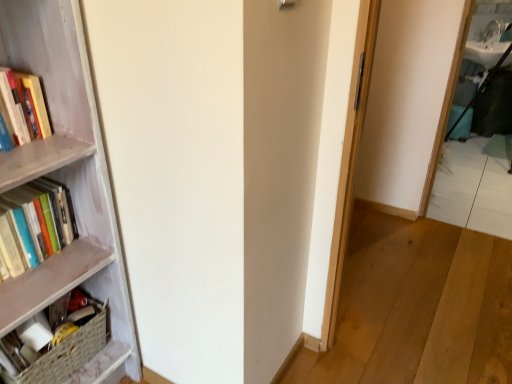
Question: Is woven basket at lower left, acting as the 2th book starting from the top, with wooden bookcase at left?

Choices:
 (A) no
 (B) yes

Answer: (A)

Question: Does woven basket at lower left, acting as the 2th book starting from the top, have a lesser width compared to wooden bookcase at left?

Choices:
 (A) yes
 (B) no

Answer: (A)

Question: Is woven basket at lower left, acting as the 2th book starting from the top, smaller than wooden bookcase at left?

Choices:
 (A) yes
 (B) no

Answer: (A)

Question: Is woven basket at lower left, acting as the 2th book starting from the top, further to the viewer compared to wooden bookcase at left?

Choices:
 (A) yes
 (B) no

Answer: (A)

Question: Does woven basket at lower left, acting as the 2th book starting from the top, appear on the left side of wooden bookcase at left?

Choices:
 (A) no
 (B) yes

Answer: (B)

Question: In the image, is hardcover books at left, the 2th book from the bottom, positioned in front of or behind wooden bookcase at left?

Choices:
 (A) front
 (B) behind

Answer: (B)

Question: In terms of height, does hardcover books at left, the 2th book from the bottom, look taller or shorter compared to wooden bookcase at left?

Choices:
 (A) short
 (B) tall

Answer: (A)

Question: From the image's perspective, is hardcover books at left, marked as the 1th book in a top-to-bottom arrangement, positioned above or below wooden bookcase at left?

Choices:
 (A) below
 (B) above

Answer: (B)

Question: Choose the correct answer: Is hardcover books at left, marked as the 1th book in a top-to-bottom arrangement, inside wooden bookcase at left or outside it?

Choices:
 (A) inside
 (B) outside

Answer: (A)

Question: In the image, is woven basket at lower left, acting as the 2th book starting from the top, positioned in front of or behind wooden bookcase at left?

Choices:
 (A) behind
 (B) front

Answer: (A)

Question: Considering the positions of woven basket at lower left, arranged as the first book when ordered from the bottom, and wooden bookcase at left in the image, is woven basket at lower left, arranged as the first book when ordered from the bottom, wider or thinner than wooden bookcase at left?

Choices:
 (A) thin
 (B) wide

Answer: (A)

Question: Choose the correct answer: Is woven basket at lower left, arranged as the first book when ordered from the bottom, inside wooden bookcase at left or outside it?

Choices:
 (A) outside
 (B) inside

Answer: (B)

Question: From a real-world perspective, is woven basket at lower left, arranged as the first book when ordered from the bottom, physically located above or below wooden bookcase at left?

Choices:
 (A) below
 (B) above

Answer: (A)

Question: Based on their sizes in the image, would you say woven basket at lower left, acting as the 2th book starting from the top, is bigger or smaller than hardcover books at left, the 2th book from the bottom?

Choices:
 (A) big
 (B) small

Answer: (A)

Question: Visually, is woven basket at lower left, acting as the 2th book starting from the top, positioned to the left or to the right of hardcover books at left, marked as the 1th book in a top-to-bottom arrangement?

Choices:
 (A) right
 (B) left

Answer: (A)